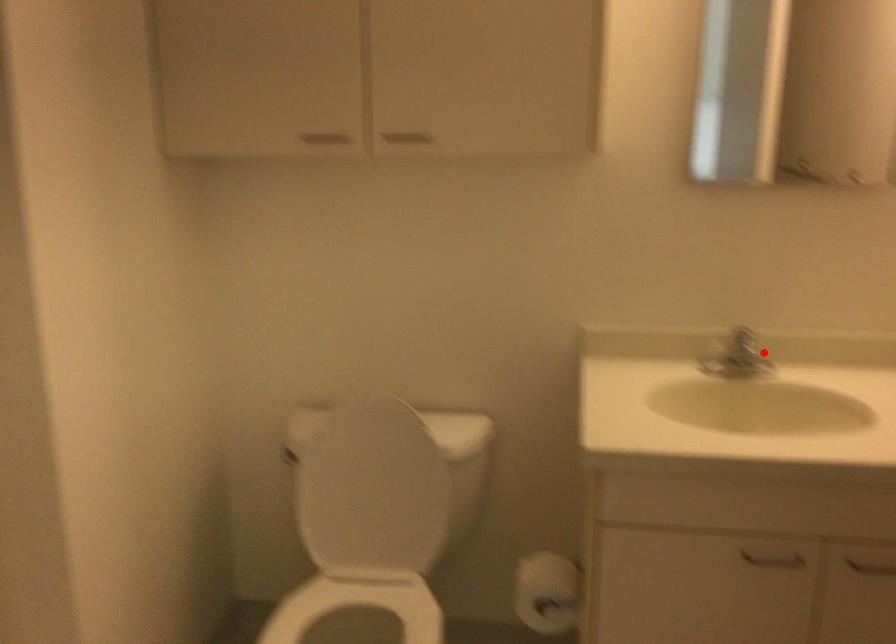
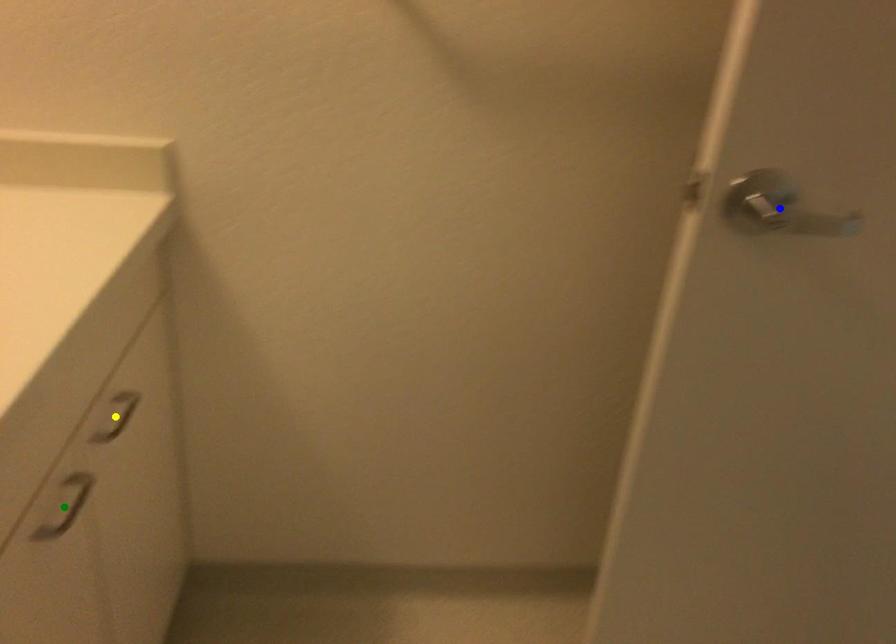
Question: I am providing you with two images of the same scene from different viewpoints. A red point is marked on the first image. You are given multiple points on the second image. In image 2, which mark is for the same physical point as the one in image 1?

Choices:
 (A) yellow point
 (B) green point
 (C) blue point

Answer: (B)